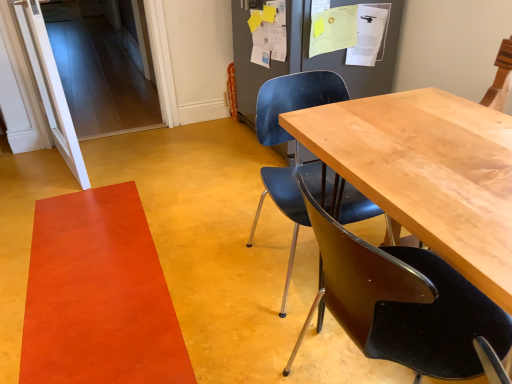
Question: Considering the relative positions of orange matte rug at lower left and light brown wood table at center in the image provided, is orange matte rug at lower left to the left or to the right of light brown wood table at center?

Choices:
 (A) left
 (B) right

Answer: (A)

Question: Is orange matte rug at lower left wider or thinner than light brown wood table at center?

Choices:
 (A) wide
 (B) thin

Answer: (A)

Question: Considering the real-world distances, which object is closest to the matte black chair at center, which appears as the 2th chair when viewed from the back?

Choices:
 (A) orange matte rug at lower left
 (B) light brown wood table at center
 (C) matte black chair at center, which is counted as the 1th chair, starting from the back

Answer: (B)

Question: Which of these objects is positioned farthest from the orange matte rug at lower left?

Choices:
 (A) matte black chair at center, which appears as the 2th chair when viewed from the back
 (B) matte black chair at center, which is counted as the 1th chair, starting from the back
 (C) light brown wood table at center

Answer: (C)